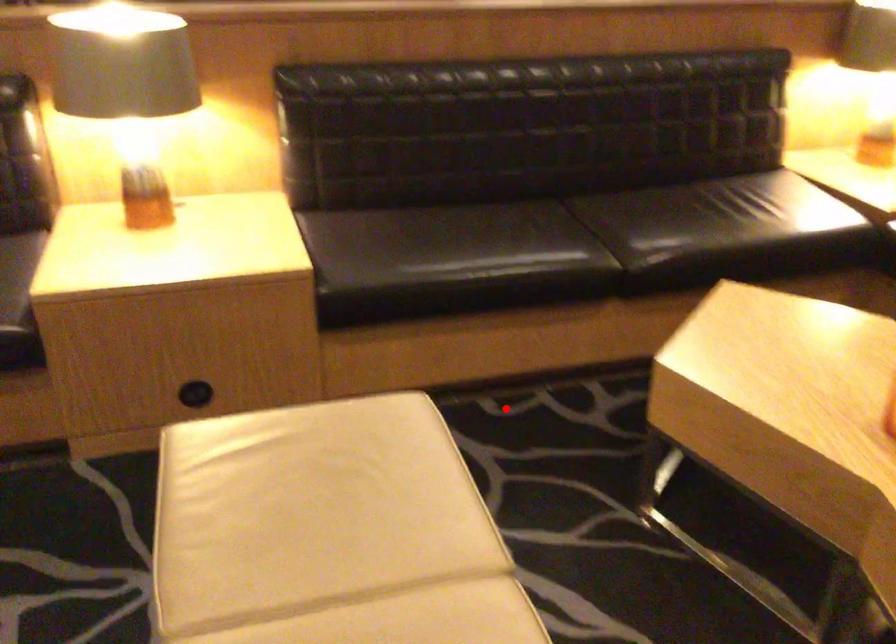
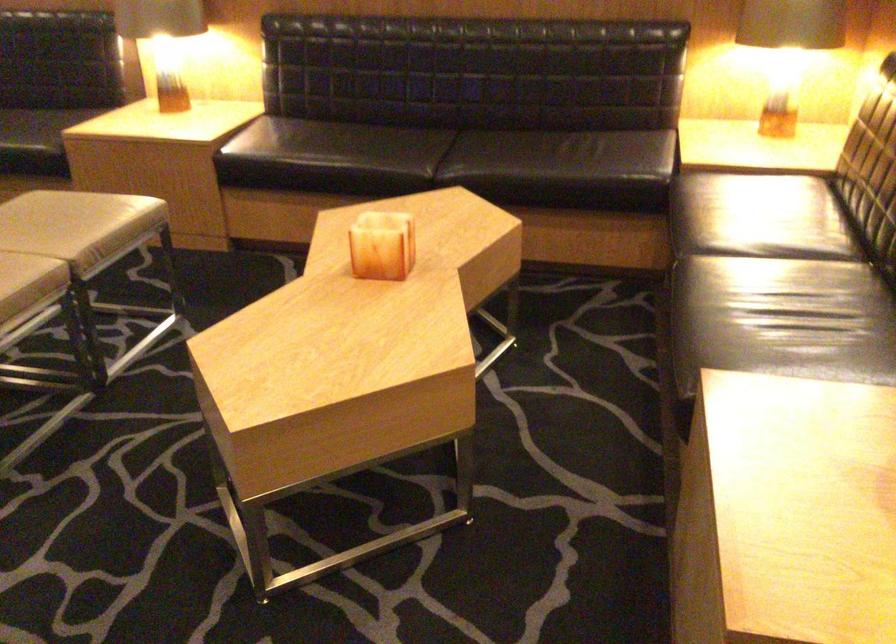
Question: I am providing you with two images of the same scene from different viewpoints. Given a red point in image1, look at the same physical point in image2. Is it:

Choices:
 (A) Closer to the viewpoint
 (B) Farther from the viewpoint

Answer: (B)